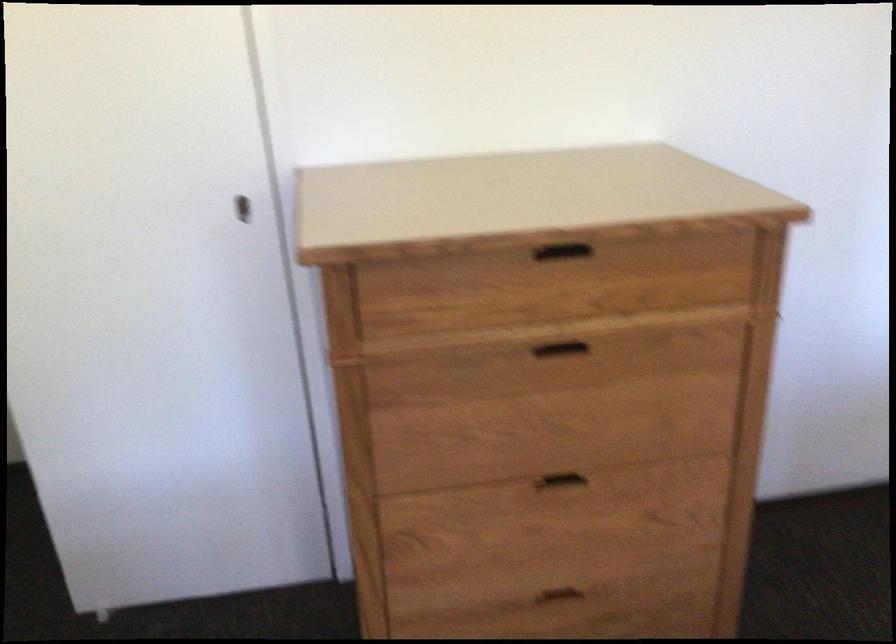
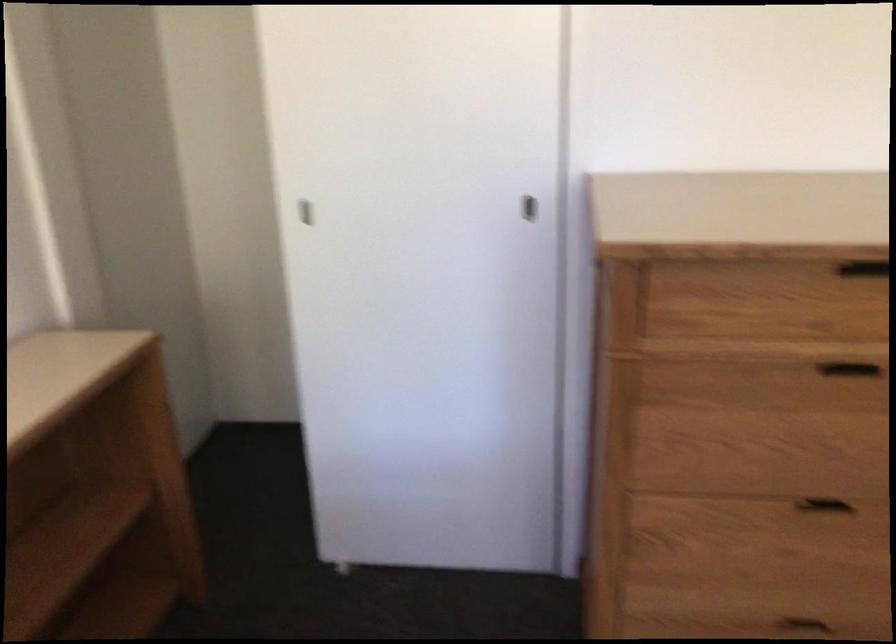
Question: Based on the continuous images, in which direction is the camera rotating? Reply with the corresponding letter.

Choices:
 (A) Left
 (B) Right
 (C) Up
 (D) Down

Answer: (A)